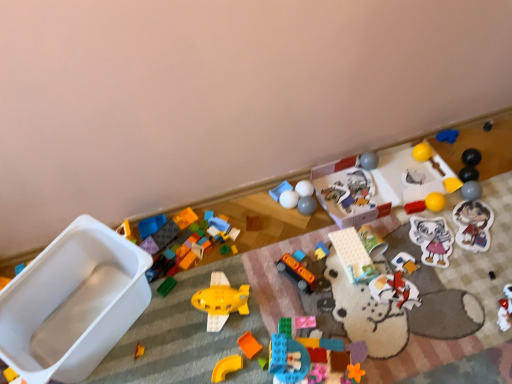
The height and width of the screenshot is (384, 512). Identify the location of vacant area that is in front of white plastic toy at center, which is the seventeenth toy from left to right. (361, 235).